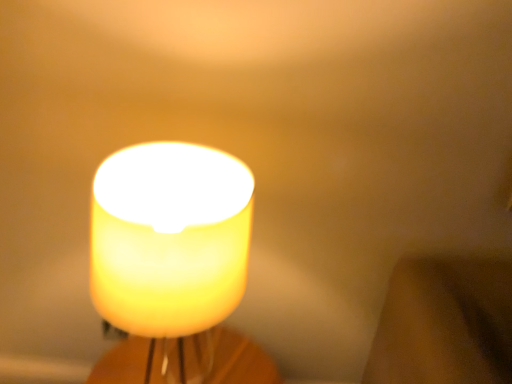
Question: Is point (147, 249) closer or farther from the camera than point (106, 382)?

Choices:
 (A) closer
 (B) farther

Answer: (A)

Question: From their relative heights in the image, would you say translucent yellow candle at center is taller or shorter than translucent glass candle at center?

Choices:
 (A) short
 (B) tall

Answer: (B)

Question: Considering the relative positions of translucent yellow candle at center and translucent glass candle at center in the image provided, is translucent yellow candle at center to the left or to the right of translucent glass candle at center?

Choices:
 (A) right
 (B) left

Answer: (A)

Question: Does point (132, 344) appear closer or farther from the camera than point (99, 167)?

Choices:
 (A) farther
 (B) closer

Answer: (A)

Question: From the image's perspective, relative to translucent yellow candle at center, is translucent glass candle at center above or below?

Choices:
 (A) below
 (B) above

Answer: (A)

Question: From their relative heights in the image, would you say translucent glass candle at center is taller or shorter than translucent yellow candle at center?

Choices:
 (A) tall
 (B) short

Answer: (B)

Question: Considering the positions of translucent glass candle at center and translucent yellow candle at center in the image, is translucent glass candle at center wider or thinner than translucent yellow candle at center?

Choices:
 (A) thin
 (B) wide

Answer: (A)